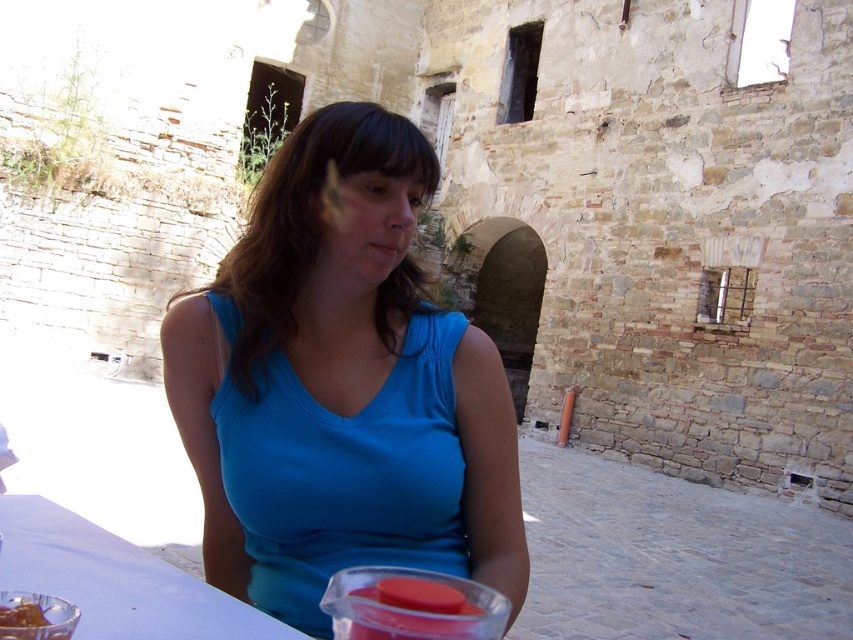
You are a waiter in a historical restaurant. You see a translucent plastic cup at lower center and a shiny brown chocolate at lower left. Is there a risk of the chocolate falling into the cup?

Yes, the translucent plastic cup at lower center is positioned under shiny brown chocolate at lower left, so there is a risk of the chocolate falling into the cup if it shifts or is disturbed.

You are a photographer trying to capture both the blue fabric shirt at center and the shiny brown chocolate at lower left in a single frame. Based on their sizes, which object should you focus on first to ensure both fit in the shot?

The blue fabric shirt at center might be wider than shiny brown chocolate at lower left, so you should focus on the blue fabric shirt at center first to ensure it fits in the frame.